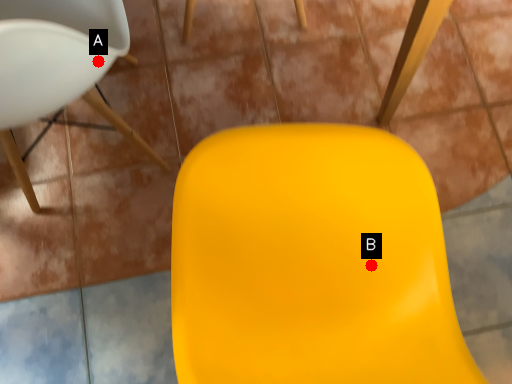
Question: Two points are circled on the image, labeled by A and B beside each circle. Which point is further to the camera?

Choices:
 (A) A is further
 (B) B is further

Answer: (B)